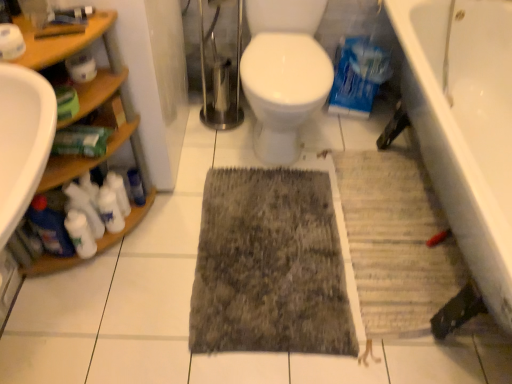
Find the location of a particular element. This screenshot has height=384, width=512. vacant space behind white matte toilet paper at upper left, the 1th toilet paper when ordered from front to back is located at coordinates (50, 28).